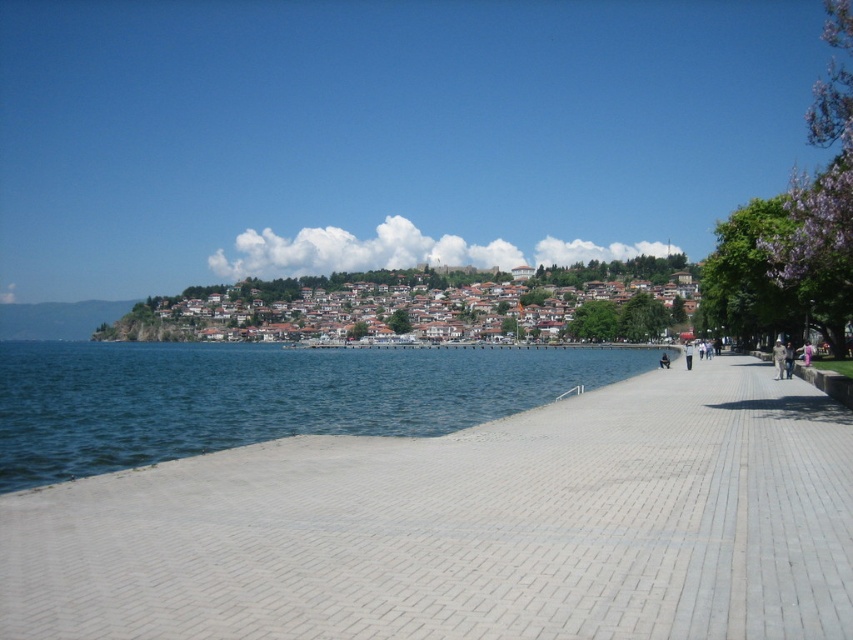
Question: Which object is closer to the camera taking this photo?

Choices:
 (A) gray brick pavement at center
 (B) blue water at lower left

Answer: (A)

Question: Which object is closer to the camera taking this photo?

Choices:
 (A) brown tiled houses at center
 (B) gray brick pavement at center

Answer: (B)

Question: Is blue water at lower left to the right of brown tiled houses at center from the viewer's perspective?

Choices:
 (A) no
 (B) yes

Answer: (A)

Question: Does gray brick pavement at center lie behind brown tiled houses at center?

Choices:
 (A) yes
 (B) no

Answer: (B)

Question: Among these objects, which one is farthest from the camera?

Choices:
 (A) blue water at lower left
 (B) gray brick pavement at center
 (C) brown tiled houses at center

Answer: (C)

Question: Does gray brick pavement at center appear on the right side of blue water at lower left?

Choices:
 (A) no
 (B) yes

Answer: (B)